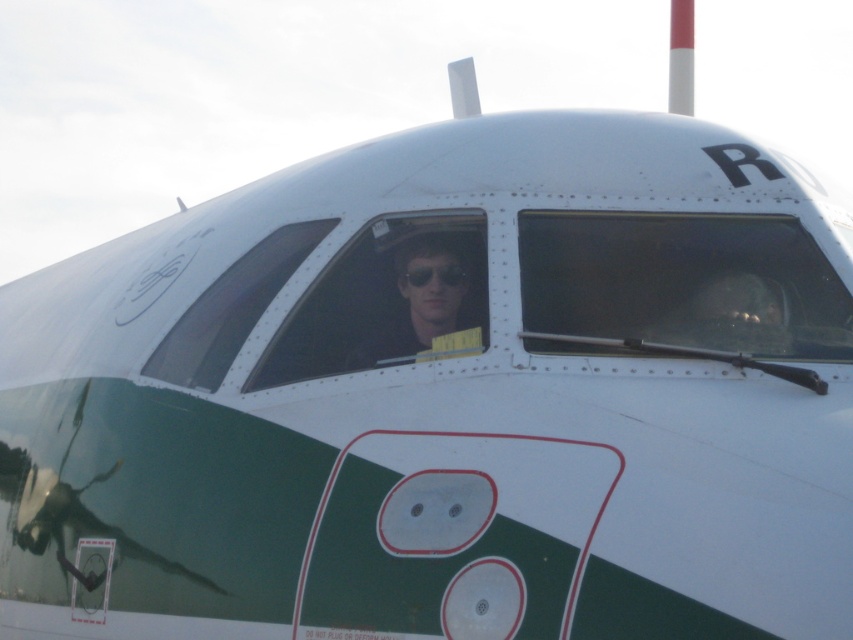
Can you confirm if matte black sunglasses at center is bigger than matte black nose at center?

Correct, matte black sunglasses at center is larger in size than matte black nose at center.

Is matte black sunglasses at center positioned behind matte black nose at center?

No, matte black sunglasses at center is in front of matte black nose at center.

Identify the location of matte black sunglasses at center. The image size is (853, 640). (422, 301).

Between matte black sunglasses at center and black matte goggles at center, which one has more height?

Standing taller between the two is matte black sunglasses at center.

Can you confirm if matte black sunglasses at center is taller than black matte goggles at center?

Yes, matte black sunglasses at center is taller than black matte goggles at center.

Find the location of a particular element. The height and width of the screenshot is (640, 853). matte black sunglasses at center is located at coordinates (422, 301).

Can you confirm if black matte goggles at center is bigger than matte black nose at center?

Indeed, black matte goggles at center has a larger size compared to matte black nose at center.

Where is `black matte goggles at center`? The height and width of the screenshot is (640, 853). black matte goggles at center is located at coordinates (437, 275).